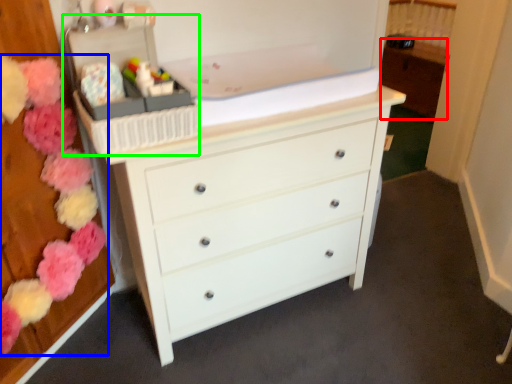
Question: Based on their relative distances, which object is farther from cabinetry (highlighted by a red box)? Choose from flower (highlighted by a blue box) and storage box (highlighted by a green box).

Choices:
 (A) flower
 (B) storage box

Answer: (A)